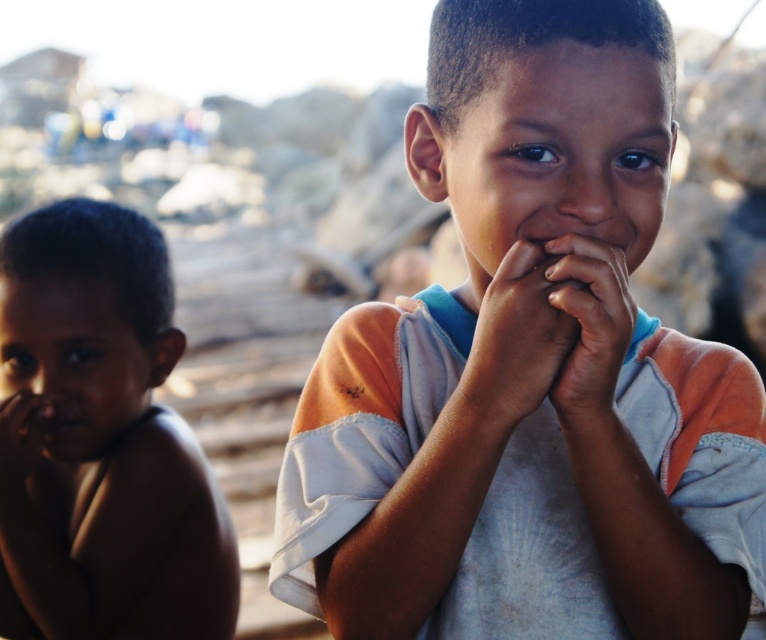
You are a photographer who wants to capture a closeup of both the white cotton shirt at center and the smooth skin nose at center in the same frame. Given their distance apart, will you need to adjust your camera lens to a wider angle to ensure both are fully visible?

The white cotton shirt at center and smooth skin nose at center are 7.94 inches apart. To capture both in the same frame without cropping, you would need to use a wider angle lens to accommodate the distance between them.

Consider the image. You are a photographer who wants to ensure both the white cotton shirt at center and the smooth skin hands at center are clearly visible in the photo. Given their sizes, which object should you focus on to ensure both are in focus?

The white cotton shirt at center has a greater height compared to smooth skin hands at center, so focusing on the white cotton shirt at center will ensure both are in focus since it is larger and requires more attention to detail.